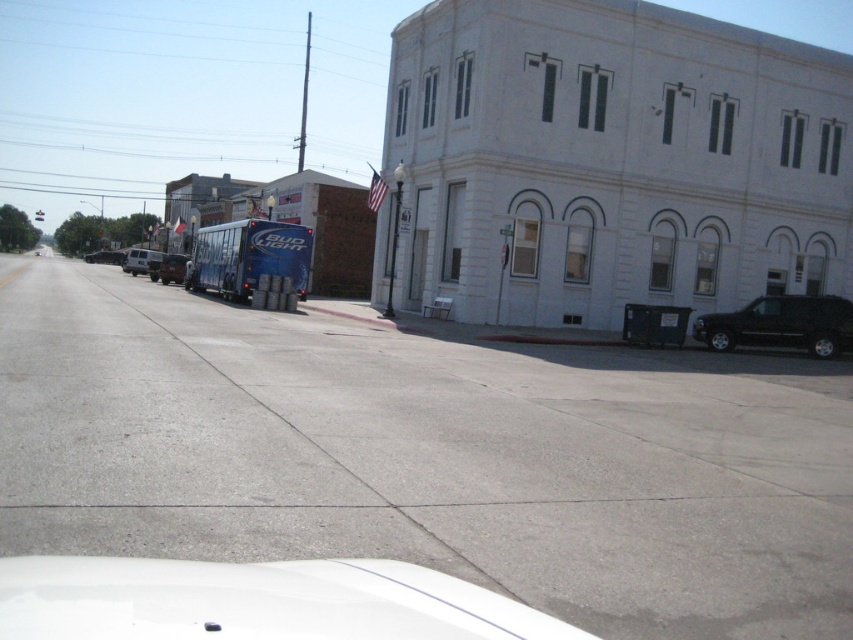
Consider the image. You are driving a car and need to park in the parking lot behind the white stone building at upper right and the black matte suv at lower right. Which object is closer to the parking lot entrance?

The black matte suv at lower right is closer to the parking lot entrance because it is parked on the street near the building, while the white stone building at upper right is a larger structure and likely farther back.